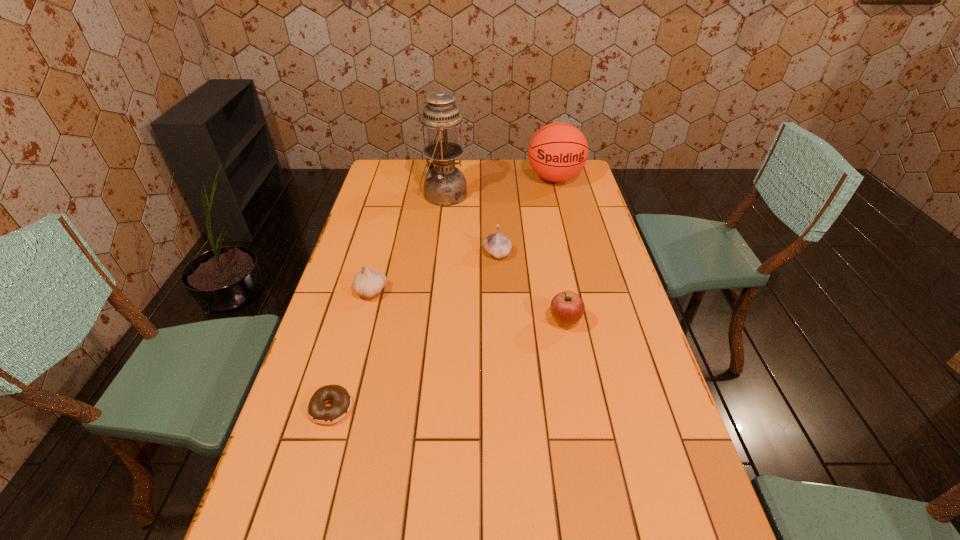
Find the location of a particular element. The height and width of the screenshot is (540, 960). object located at the right edge is located at coordinates (558, 151).

At what (x,y) coordinates should I click in order to perform the action: click on object at the far right corner. Please return your answer as a coordinate pair (x, y). Looking at the image, I should click on (558, 151).

The width and height of the screenshot is (960, 540). What are the coordinates of `vacant region at the far edge of the desktop` in the screenshot? It's located at (486, 164).

In the image, there is a desktop. Where is `vacant space at the left edge`? The image size is (960, 540). vacant space at the left edge is located at coordinates (252, 518).

This screenshot has height=540, width=960. In order to click on free region at the right edge of the desktop in this screenshot , I will do `click(660, 458)`.

In the image, there is a desktop. Where is `free space at the far left corner`? The image size is (960, 540). free space at the far left corner is located at coordinates (382, 185).

This screenshot has height=540, width=960. I want to click on vacant area between the second tallest object and the oil lamp, so click(499, 186).

Where is `free space between the basketball and the shortest object`? The width and height of the screenshot is (960, 540). free space between the basketball and the shortest object is located at coordinates (444, 293).

Find the location of a particular element. This screenshot has width=960, height=540. empty space that is in between the apple and the basketball is located at coordinates (560, 250).

Find the location of a particular element. free spot between the shorter garlic and the third object from right to left is located at coordinates (434, 272).